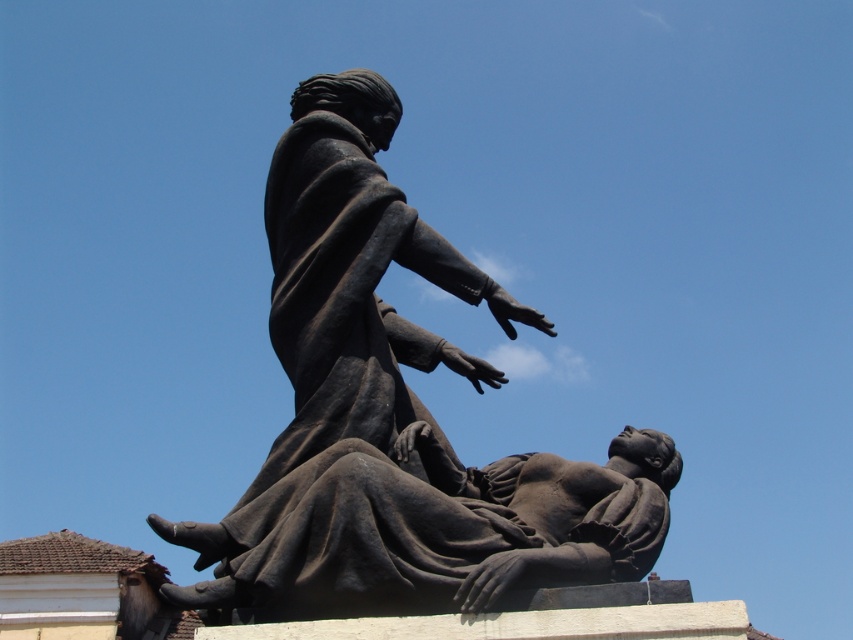
Is bronze statue at center above matte black statue at center?

Yes.

Who is positioned more to the right, bronze statue at center or matte black statue at center?

Positioned to the right is matte black statue at center.

Is point (302, 346) positioned in front of point (466, 541)?

No.

The height and width of the screenshot is (640, 853). In order to click on bronze statue at center in this screenshot , I will do `click(396, 417)`.